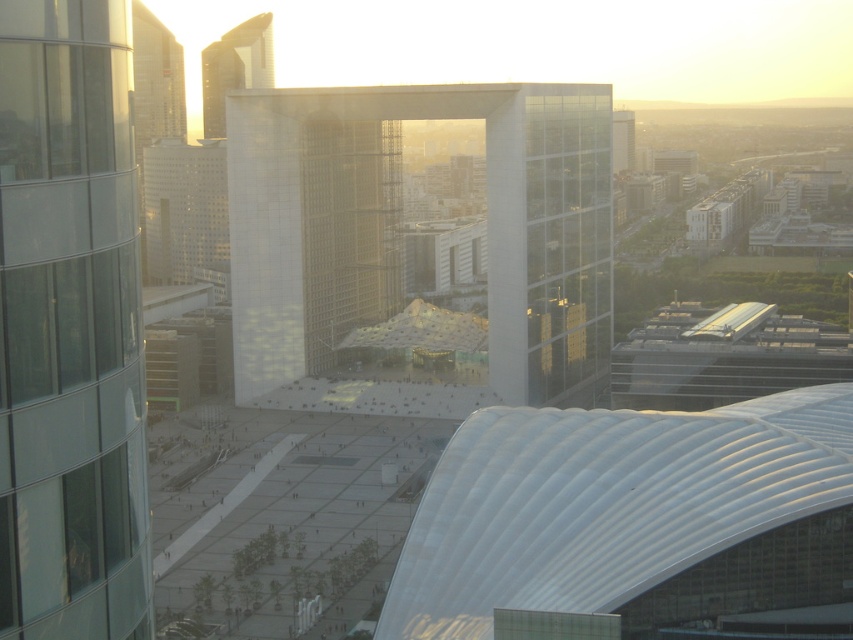
Question: Among these points, which one is nearest to the camera?

Choices:
 (A) (149, 44)
 (B) (358, 401)
 (C) (252, 49)

Answer: (B)

Question: Can you confirm if transparent glass building at center is positioned above white glass building at upper center?

Choices:
 (A) no
 (B) yes

Answer: (A)

Question: Does transparent glass building at center have a greater width compared to white glass building at upper center?

Choices:
 (A) yes
 (B) no

Answer: (A)

Question: Is matte glass skyscraper at upper left above white glass building at upper center?

Choices:
 (A) yes
 (B) no

Answer: (B)

Question: Which point is closer to the camera?

Choices:
 (A) transparent glass building at center
 (B) matte glass skyscraper at upper left
 (C) transparent glass tower at left
 (D) white glass building at upper center

Answer: (C)

Question: Which point is farther from the camera taking this photo?

Choices:
 (A) (550, 157)
 (B) (132, 44)
 (C) (125, 118)

Answer: (B)